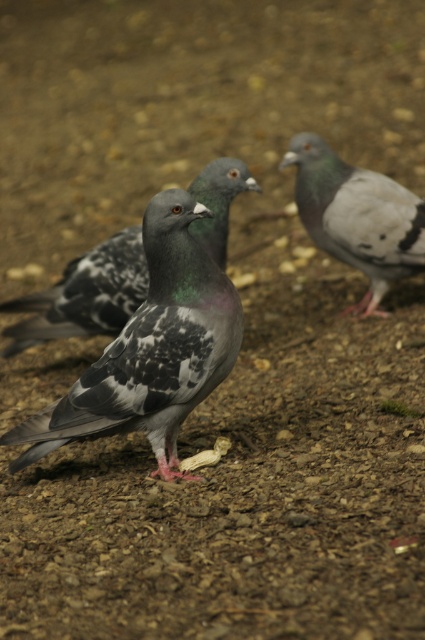
You are a photographer aiming to capture a clear shot of the speckled feathered pigeon at center and the speckled feather pigeon at center. Based on their positions, which one is closer to the camera?

The speckled feathered pigeon at center is closer to the camera because it is located below the speckled feather pigeon at center, which suggests it is in front of the other pigeon.